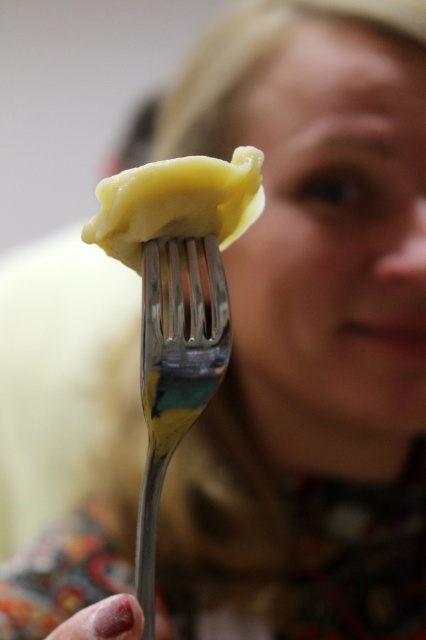
Does silver metallic fork at center appear on the left side of yellow matte dumpling at center?

Yes, silver metallic fork at center is to the left of yellow matte dumpling at center.

Is silver metallic fork at center thinner than yellow matte dumpling at center?

→ Yes.

Is point (141, 369) closer to camera compared to point (132, 266)?

Yes, it is.

I want to click on silver metallic fork at center, so click(x=175, y=371).